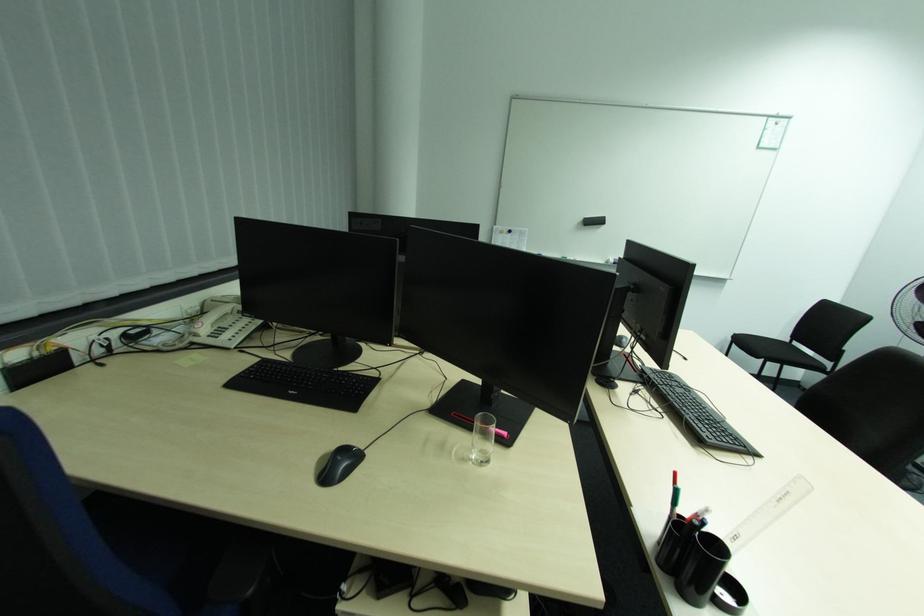
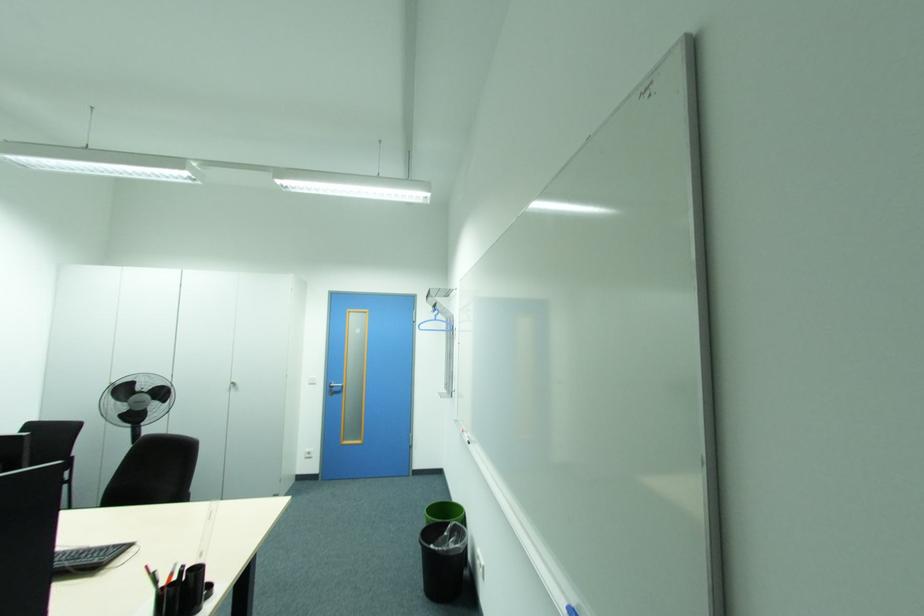
Question: The camera is either moving clockwise (left) or counter-clockwise (right) around the object. The first image is from the beginning of the video and the second image is from the end. Is the camera moving left or right when shooting the video?

Choices:
 (A) Left
 (B) Right

Answer: (A)